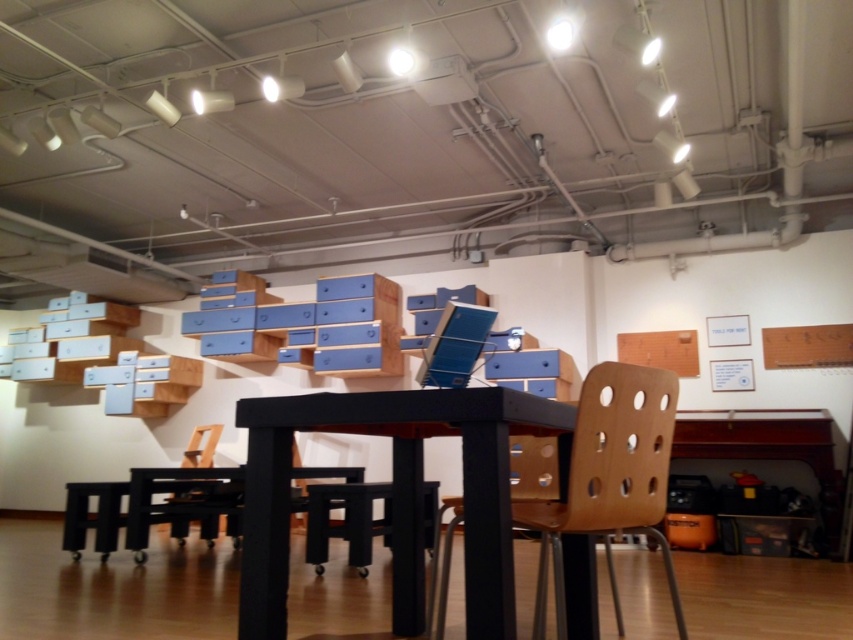
In the scene shown: Can you confirm if black matte table at center is positioned below wooden chair at lower left?

Incorrect, black matte table at center is not positioned below wooden chair at lower left.

Is black matte table at center bigger than wooden chair at lower left?

Yes, black matte table at center is bigger than wooden chair at lower left.

What are the coordinates of `black matte table at center` in the screenshot? It's located at (396, 493).

Locate an element on the screen. The image size is (853, 640). black matte table at center is located at coordinates (396, 493).

Does point (312, 509) come closer to viewer compared to point (206, 451)?

Yes, it is.

Between matte black stool at center and wooden chair at lower left, which one appears on the right side from the viewer's perspective?

matte black stool at center is more to the right.

Find the location of a particular element. matte black stool at center is located at coordinates (346, 522).

Does beech wood chair at center have a greater height compared to black plastic stool at lower left?

Indeed, beech wood chair at center has a greater height compared to black plastic stool at lower left.

Is beech wood chair at center bigger than black plastic stool at lower left?

Indeed, beech wood chair at center has a larger size compared to black plastic stool at lower left.

What do you see at coordinates (608, 477) in the screenshot?
I see `beech wood chair at center` at bounding box center [608, 477].

You are a GUI agent. You are given a task and a screenshot of the screen. Output one action in this format:
    pyautogui.click(x=<x>, y=<y>)
    Task: Click on the beech wood chair at center
    The height and width of the screenshot is (640, 853).
    Given the screenshot: What is the action you would take?
    pyautogui.click(x=608, y=477)